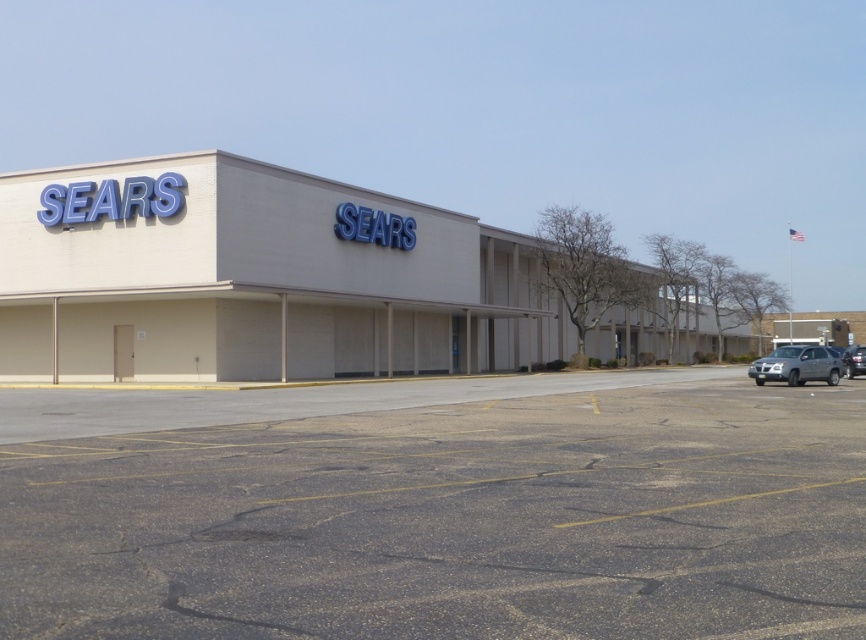
You are standing at the entrance of the Sears retail store and want to find the gray asphalt parking lot at lower center. According to the coordinates provided, where should you look relative to your position?

The gray asphalt parking lot at lower center is located at point 0.816 on the x axis and 0.524 on the y axis relative to your position at the entrance.

You are standing at the entrance of the Sears retail store and want to walk to the parking lot. There are two points marked on the ground in front of you. The first point is labeled as point [658,420] and the second is point [838,376]. Which point is closer to the store entrance?

Point [658,420] is closer to the store entrance because it is in front of point [838,376], meaning it is nearer to the store.